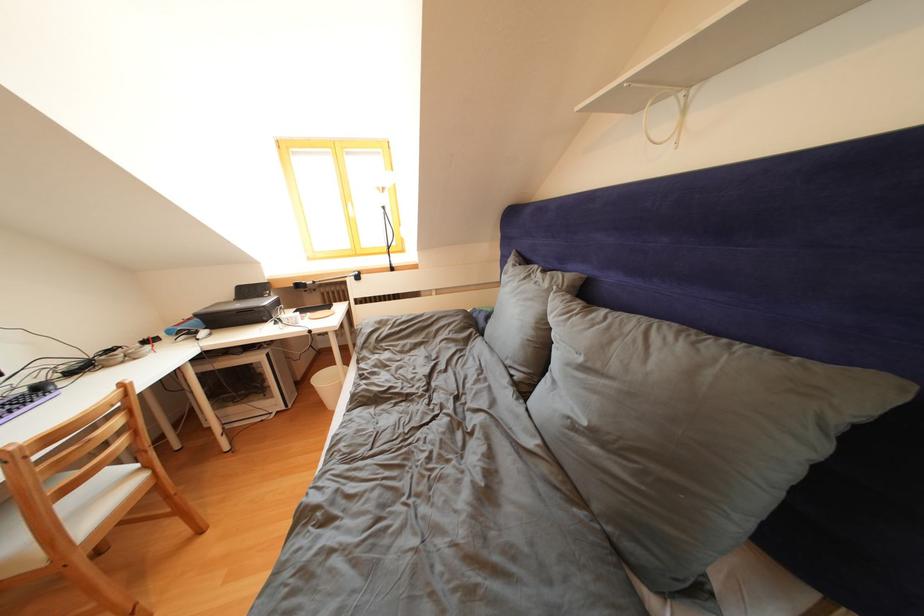
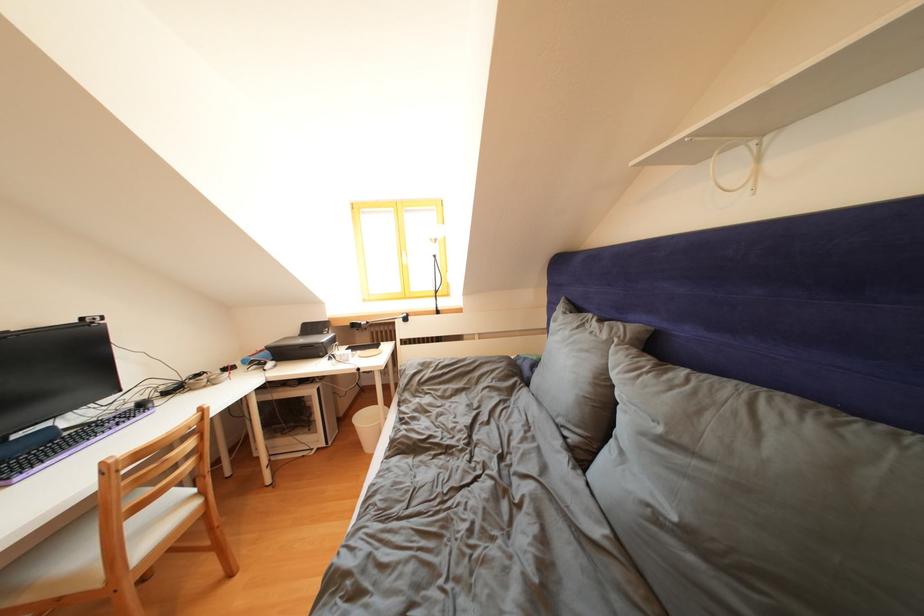
Question: In a continuous first-person perspective shot, in which direction is the camera moving?

Choices:
 (A) Left
 (B) Right
 (C) Forward
 (D) Backward

Answer: (A)